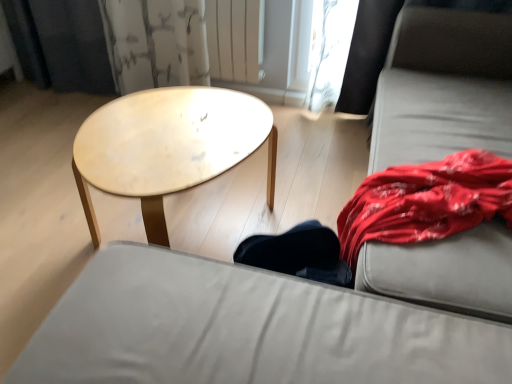
Locate an element on the screen. blank space situated above light wood/texture coffee table at center (from a real-world perspective) is located at coordinates (165, 137).